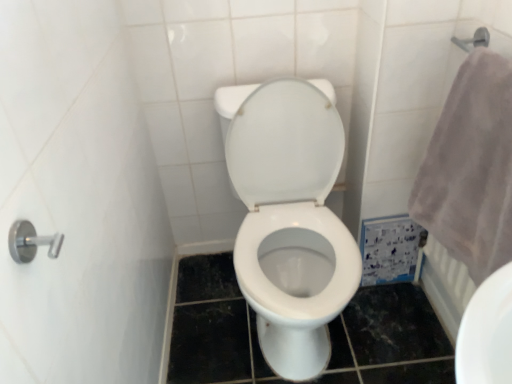
Identify the location of white glossy toilet at center. (291, 223).

The width and height of the screenshot is (512, 384). What do you see at coordinates (291, 223) in the screenshot? I see `white glossy toilet at center` at bounding box center [291, 223].

Measure the distance between white glossy toilet at center and camera.

A distance of 1.06 meters exists between white glossy toilet at center and camera.

Identify the location of gray fluffy towel at right. This screenshot has height=384, width=512. (471, 168).

This screenshot has height=384, width=512. What do you see at coordinates (471, 168) in the screenshot? I see `gray fluffy towel at right` at bounding box center [471, 168].

Measure the distance between point [492,226] and camera.

The distance of point [492,226] from camera is 37.13 inches.

This screenshot has height=384, width=512. What are the coordinates of `white glossy toilet at center` in the screenshot? It's located at pos(291,223).

Considering the positions of objects white glossy toilet at center and gray fluffy towel at right in the image provided, who is more to the right, white glossy toilet at center or gray fluffy towel at right?

From the viewer's perspective, gray fluffy towel at right appears more on the right side.

Based on the photo, does white glossy toilet at center lie behind gray fluffy towel at right?

Yes, white glossy toilet at center is further from the viewer.

Does point (280, 215) come closer to viewer compared to point (482, 139)?

No, it is behind (482, 139).

From the image's perspective, is white glossy toilet at center under gray fluffy towel at right?

Yes, from the image's perspective, white glossy toilet at center is below gray fluffy towel at right.

From a real-world perspective, is white glossy toilet at center physically located above or below gray fluffy towel at right?

In terms of real-world spatial position, white glossy toilet at center is below gray fluffy towel at right.

Is white glossy toilet at center wider than gray fluffy towel at right?

Correct, the width of white glossy toilet at center exceeds that of gray fluffy towel at right.

Is white glossy toilet at center taller or shorter than gray fluffy towel at right?

In the image, white glossy toilet at center appears to be taller than gray fluffy towel at right.

Considering the relative sizes of white glossy toilet at center and gray fluffy towel at right in the image provided, is white glossy toilet at center smaller than gray fluffy towel at right?

Actually, white glossy toilet at center might be larger than gray fluffy towel at right.

Is white glossy toilet at center positioned beyond the bounds of gray fluffy towel at right?

white glossy toilet at center lies outside gray fluffy towel at right's area.

Based on the photo, is white glossy toilet at center not near gray fluffy towel at right?

No, there isn't a large distance between white glossy toilet at center and gray fluffy towel at right.

Does white glossy toilet at center turn towards gray fluffy towel at right?

No, white glossy toilet at center is not aimed at gray fluffy towel at right.

Locate an element on the screen. The height and width of the screenshot is (384, 512). bath towel on the right of white glossy toilet at center is located at coordinates (471, 168).

Would you say gray fluffy towel at right is to the left or to the right of white glossy toilet at center in the picture?

In the image, gray fluffy towel at right appears on the right side of white glossy toilet at center.

Relative to white glossy toilet at center, is gray fluffy towel at right in front or behind?

gray fluffy towel at right is in front of white glossy toilet at center.

Which is in front, point (490, 128) or point (264, 182)?

The point (490, 128) is closer to the camera.

From the image's perspective, between gray fluffy towel at right and white glossy toilet at center, who is located below?

From the image's view, white glossy toilet at center is below.

From a real-world perspective, is gray fluffy towel at right on white glossy toilet at center?

Yes, from a real-world perspective, gray fluffy towel at right is on top of white glossy toilet at center.

Which of these two, gray fluffy towel at right or white glossy toilet at center, is wider?

With larger width is white glossy toilet at center.

Who is taller, gray fluffy towel at right or white glossy toilet at center?

With more height is white glossy toilet at center.

Considering the sizes of gray fluffy towel at right and white glossy toilet at center in the image, is gray fluffy towel at right bigger or smaller than white glossy toilet at center?

Considering their sizes, gray fluffy towel at right takes up less space than white glossy toilet at center.

Is white glossy toilet at center located within gray fluffy towel at right?

No, white glossy toilet at center is not surrounded by gray fluffy towel at right.

Is gray fluffy towel at right next to white glossy toilet at center and touching it?

gray fluffy towel at right and white glossy toilet at center are not in contact.

Does gray fluffy towel at right turn towards white glossy toilet at center?

Yes, gray fluffy towel at right is oriented towards white glossy toilet at center.

How much distance is there between gray fluffy towel at right and white glossy toilet at center?

They are 15.34 inches apart.

Find the location of `toilet located below the gray fluffy towel at right (from the image's perspective)`. toilet located below the gray fluffy towel at right (from the image's perspective) is located at coordinates (291, 223).

Identify the location of bath towel lying above the white glossy toilet at center (from the image's perspective). (471, 168).

Where is `toilet behind the gray fluffy towel at right`? The image size is (512, 384). toilet behind the gray fluffy towel at right is located at coordinates (291, 223).